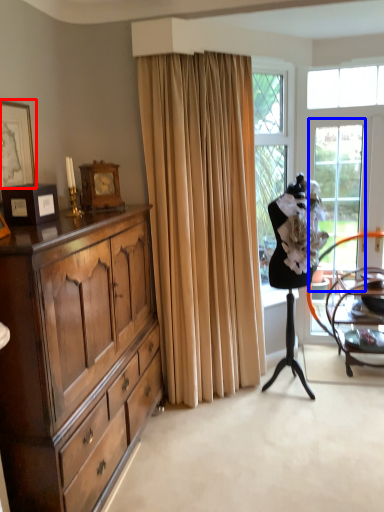
Question: Among these objects, which one is farthest to the camera, picture frame (highlighted by a red box) or screen door (highlighted by a blue box)?

Choices:
 (A) picture frame
 (B) screen door

Answer: (B)